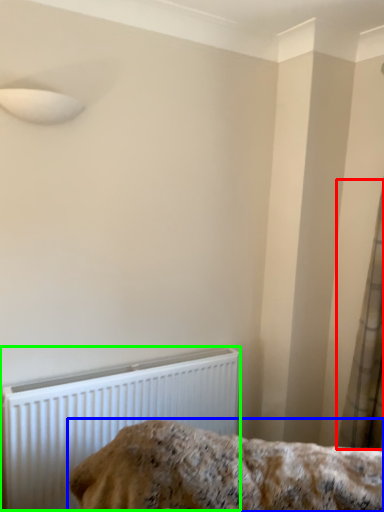
Question: Considering the real-world distances, which object is farthest from curtain (highlighted by a red box)? furniture (highlighted by a blue box) or radiator (highlighted by a green box)?

Choices:
 (A) furniture
 (B) radiator

Answer: (B)